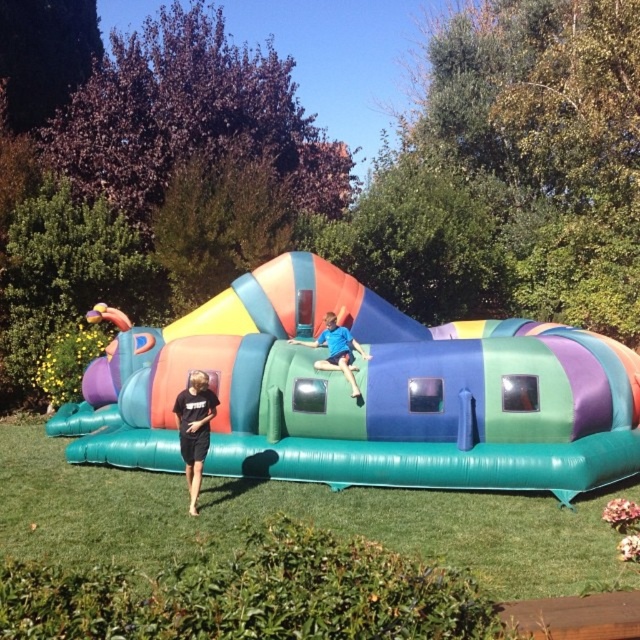
You are standing at the origin point of the coordinate system. The multicolored inflatable at center is located at point 0.616, 0.570. If you want to walk directly towards it, which direction should you head?

Since the multicolored inflatable at center is located at coordinates (364,394), which is northeast of the origin point, you should head northeast to reach it.